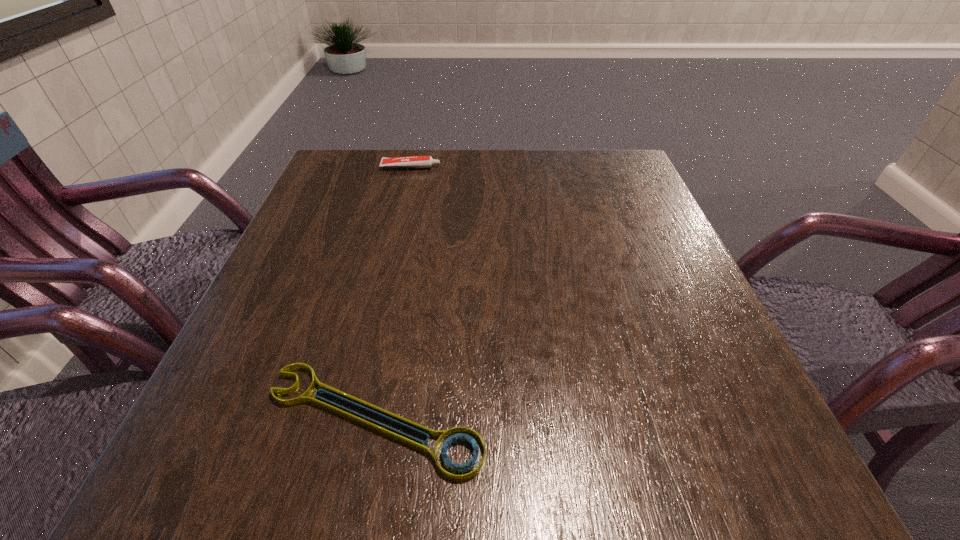
The image size is (960, 540). Find the location of `vacant space that satisfies the following two spatial constraints: 1. on the back side of the nearer object; 2. at the nozzle of the toothpaste`. vacant space that satisfies the following two spatial constraints: 1. on the back side of the nearer object; 2. at the nozzle of the toothpaste is located at coordinates (422, 167).

Find the location of a particular element. The height and width of the screenshot is (540, 960). vacant space that satisfies the following two spatial constraints: 1. at the nozzle of the toothpaste; 2. on the right side of the wrench is located at coordinates (353, 419).

You are a GUI agent. You are given a task and a screenshot of the screen. Output one action in this format:
    pyautogui.click(x=<x>, y=<y>)
    Task: Click on the free location that satisfies the following two spatial constraints: 1. at the nozzle of the taller object; 2. on the back side of the wrench
    The image size is (960, 540).
    Given the screenshot: What is the action you would take?
    pyautogui.click(x=353, y=419)

Image resolution: width=960 pixels, height=540 pixels. Identify the location of free space that satisfies the following two spatial constraints: 1. at the nozzle of the toothpaste; 2. on the left side of the wrench. (353, 419).

Identify the location of vacant area in the image that satisfies the following two spatial constraints: 1. at the nozzle of the farther object; 2. on the right side of the shorter object. This screenshot has height=540, width=960. (353, 419).

You are a GUI agent. You are given a task and a screenshot of the screen. Output one action in this format:
    pyautogui.click(x=<x>, y=<y>)
    Task: Click on the free space in the image that satisfies the following two spatial constraints: 1. at the nozzle of the toothpaste; 2. on the right side of the nearer object
    This screenshot has width=960, height=540.
    Given the screenshot: What is the action you would take?
    pyautogui.click(x=353, y=419)

Identify the location of free space that satisfies the following two spatial constraints: 1. at the nozzle of the wrench; 2. on the right side of the toothpaste. The image size is (960, 540). (353, 419).

Find the location of a particular element. Image resolution: width=960 pixels, height=540 pixels. vacant space that satisfies the following two spatial constraints: 1. at the nozzle of the farther object; 2. on the right side of the wrench is located at coordinates (353, 419).

Find the location of a particular element. vacant region that satisfies the following two spatial constraints: 1. at the nozzle of the shorter object; 2. on the left side of the toothpaste is located at coordinates (353, 419).

Locate an element on the screen. blank space that satisfies the following two spatial constraints: 1. at the nozzle of the farther object; 2. on the left side of the wrench is located at coordinates (353, 419).